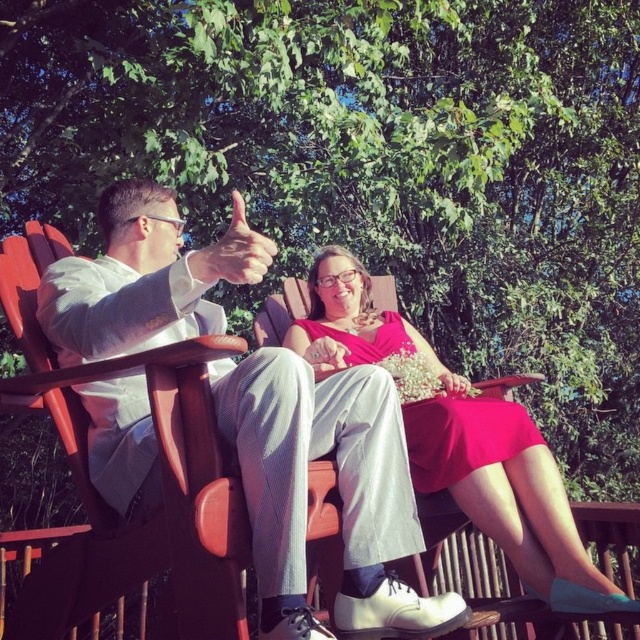
Question: In this image, where is light gray suit at center located relative to matte pink dress at center?

Choices:
 (A) left
 (B) right

Answer: (A)

Question: Which point is closer to the camera?

Choices:
 (A) (420, 460)
 (B) (154, 467)

Answer: (B)

Question: Is light gray suit at center to the left of matte pink dress at center from the viewer's perspective?

Choices:
 (A) no
 (B) yes

Answer: (B)

Question: Which object is closer to the camera taking this photo?

Choices:
 (A) light gray suit at center
 (B) matte pink dress at center

Answer: (A)

Question: Is light gray suit at center positioned in front of matte pink dress at center?

Choices:
 (A) no
 (B) yes

Answer: (B)